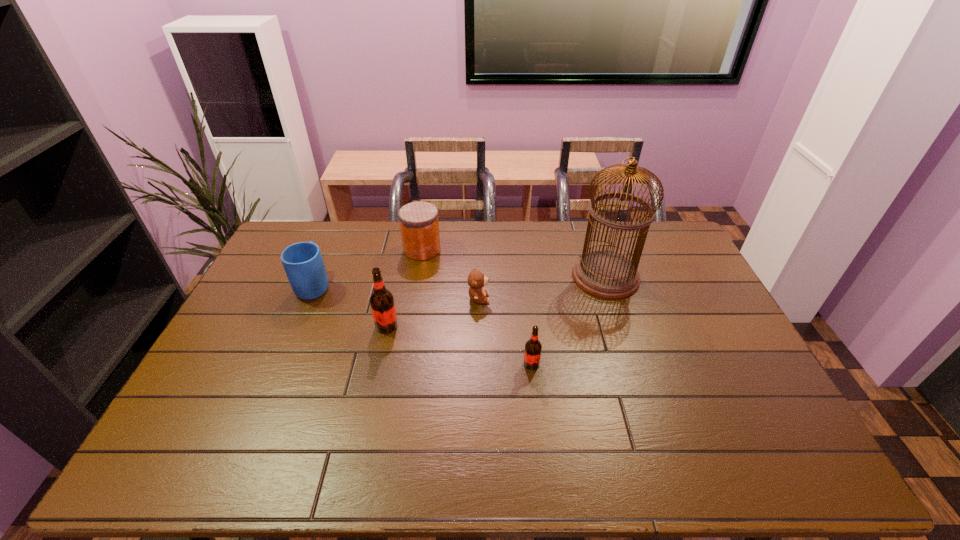
Find the location of a particular element. This screenshot has height=540, width=960. vacant space that's between the mug and the fifth shortest object is located at coordinates (350, 305).

You are a GUI agent. You are given a task and a screenshot of the screen. Output one action in this format:
    pyautogui.click(x=<x>, y=<y>)
    Task: Click on the blank region between the tallest object and the nearer root beer
    
    Given the screenshot: What is the action you would take?
    pyautogui.click(x=568, y=320)

Identify the location of unoccupied area between the birdcage and the jar. This screenshot has height=540, width=960. (514, 263).

Locate an element on the screen. unoccupied position between the shortest object and the jar is located at coordinates (450, 274).

Find the location of a particular element. The height and width of the screenshot is (540, 960). free area in between the taller root beer and the mug is located at coordinates (350, 305).

Find the location of a particular element. This screenshot has width=960, height=540. empty location between the leftmost object and the shortest object is located at coordinates (396, 292).

Where is `free area in between the shorter root beer and the mug`? This screenshot has height=540, width=960. free area in between the shorter root beer and the mug is located at coordinates (423, 324).

Locate an element on the screen. free area in between the shortest object and the left root beer is located at coordinates (433, 312).

Select which object is the second closest to the jar. Please provide its 2D coordinates. Your answer should be formatted as a tuple, i.e. [(x, y)], where the tuple contains the x and y coordinates of a point satisfying the conditions above.

[(303, 263)]

Select which object appears as the fifth closest to the jar. Please provide its 2D coordinates. Your answer should be formatted as a tuple, i.e. [(x, y)], where the tuple contains the x and y coordinates of a point satisfying the conditions above.

[(532, 354)]